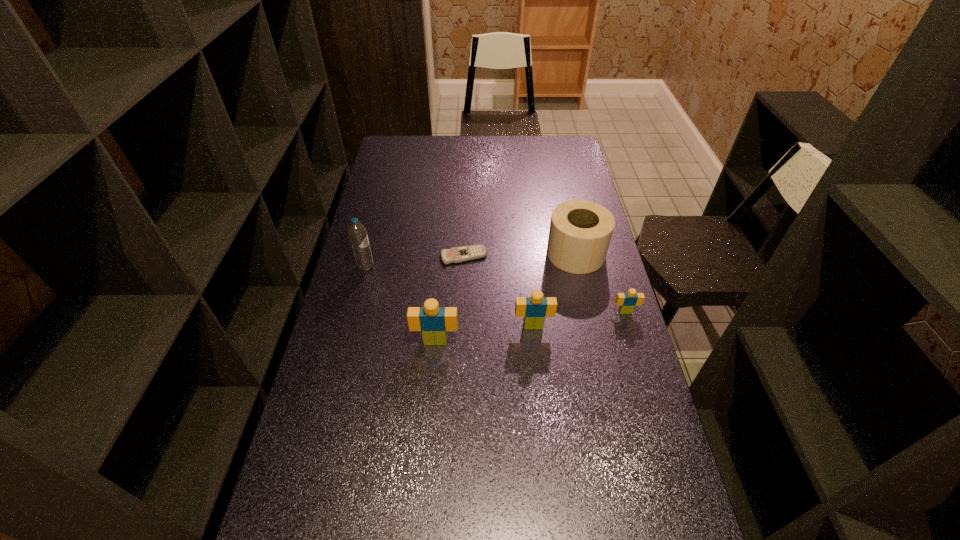
Please point a spot on the left to add another Lego. Please provide its 2D coordinates. Your answer should be formatted as a tuple, i.e. [(x, y)], where the tuple contains the x and y coordinates of a point satisfying the conditions above.

[(332, 357)]